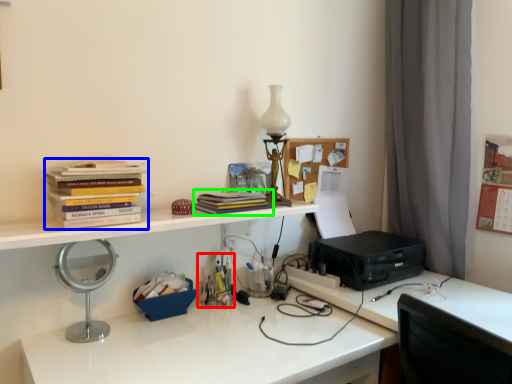
Question: Estimate the real-world distances between objects in this image. Which object is closer to stationery (highlighted by a red box), book (highlighted by a blue box) or book (highlighted by a green box)?

Choices:
 (A) book
 (B) book

Answer: (B)